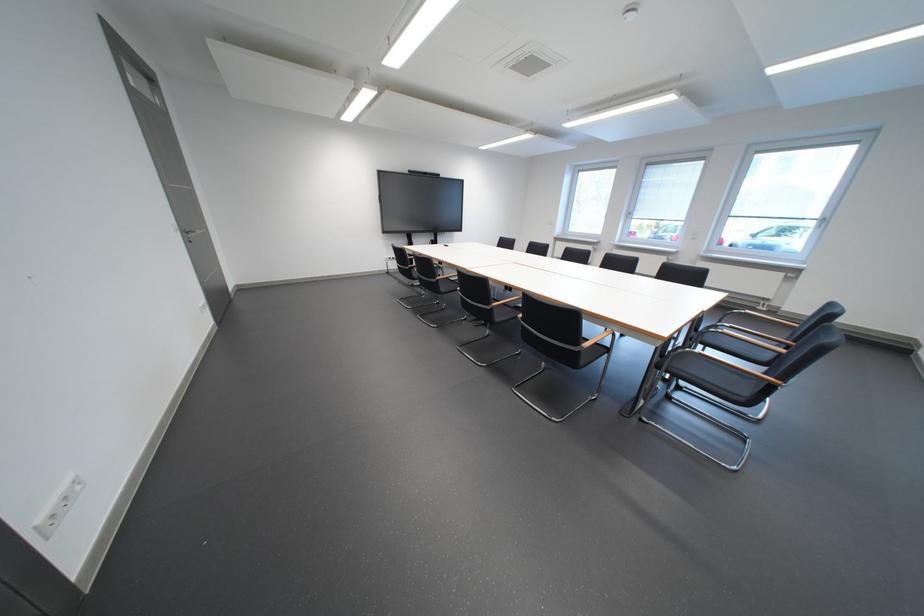
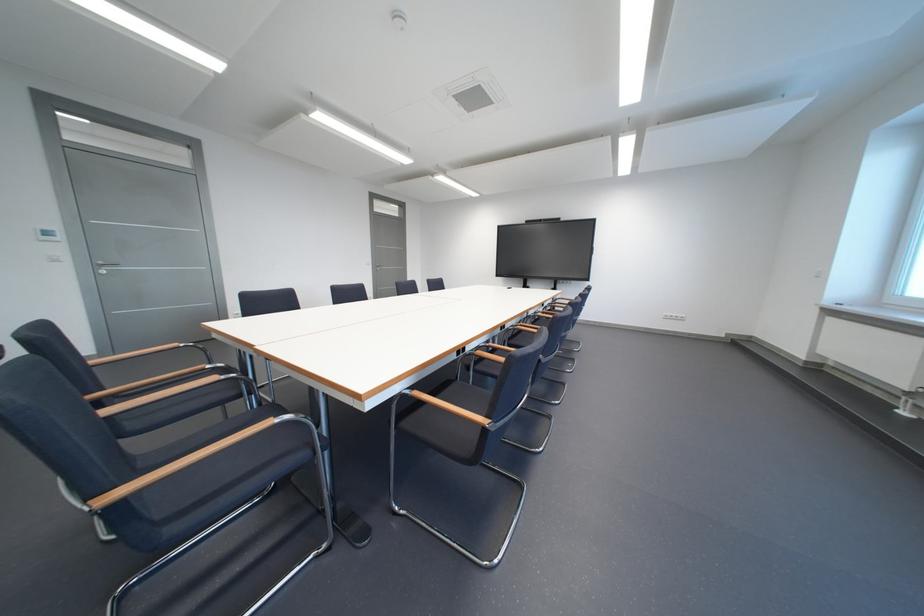
Question: I am providing you with two images of the same scene from different viewpoints. After the viewpoint changes to image2, which objects are now occluded?

Choices:
 (A) silver door handle
 (B) chair sitting surface
 (C) beige computer speaker
 (D) wooden chair armrest

Answer: (D)